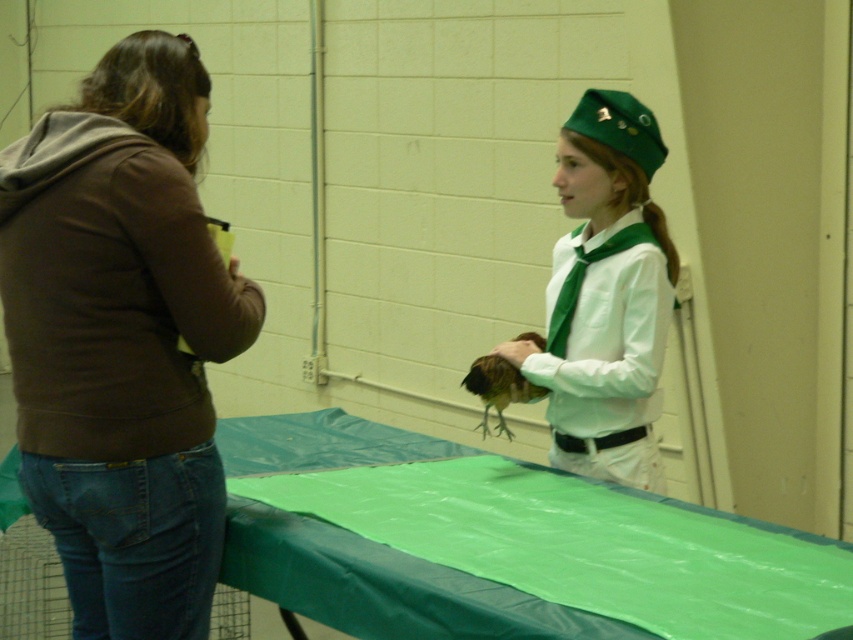
Between brown cotton hoodie at left and green matte uniform at center, which one appears on the left side from the viewer's perspective?

Positioned to the left is brown cotton hoodie at left.

Which is behind, point (90, 333) or point (630, 252)?

The point (630, 252) is behind.

Between point (190, 618) and point (570, 204), which one is positioned in front?

Positioned in front is point (190, 618).

At what (x,y) coordinates should I click in order to perform the action: click on brown cotton hoodie at left. Please return your answer as a coordinate pair (x, y). Image resolution: width=853 pixels, height=640 pixels. Looking at the image, I should click on click(122, 339).